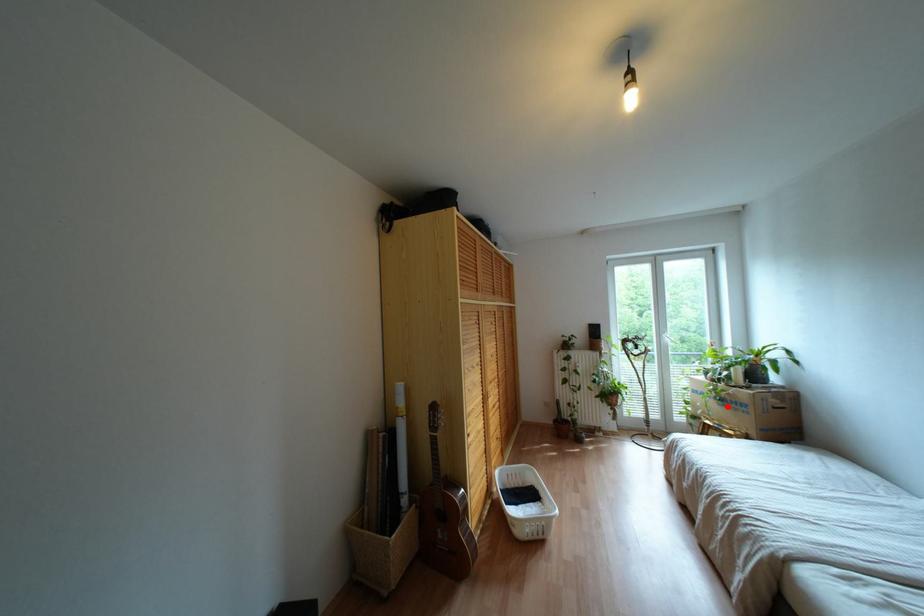
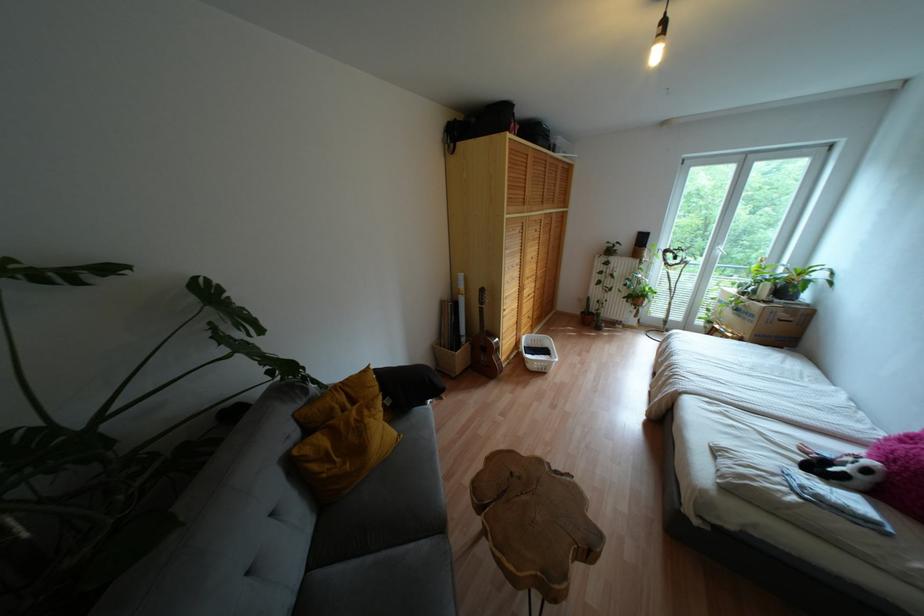
Where in the second image is the point corresponding to the highlighted location from the first image?

(737, 315)